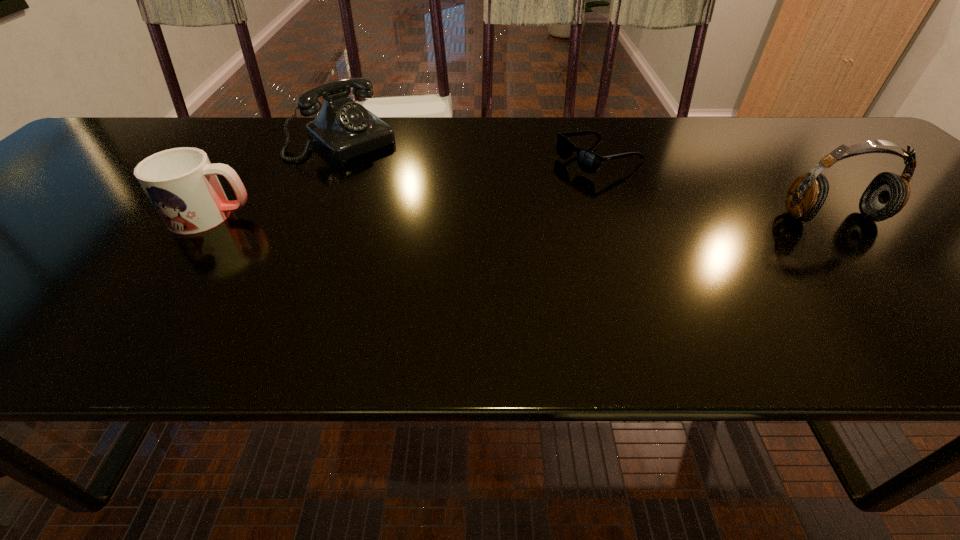
Find the location of a particular element. free spot located on the front-facing side of the second object from right to left is located at coordinates (495, 201).

Where is `free region located 0.180m on the dial of the telephone`? Image resolution: width=960 pixels, height=540 pixels. free region located 0.180m on the dial of the telephone is located at coordinates (409, 189).

You are a GUI agent. You are given a task and a screenshot of the screen. Output one action in this format:
    pyautogui.click(x=<x>, y=<y>)
    Task: Click on the free space located on the dial of the telephone
    The image size is (960, 540).
    Given the screenshot: What is the action you would take?
    pyautogui.click(x=406, y=187)

Identify the location of free space located 0.150m on the dial of the telephone. (402, 183).

Locate an element on the screen. The image size is (960, 540). sunglasses that is at the far edge is located at coordinates (588, 161).

In order to click on telephone at the far edge in this screenshot , I will do `click(343, 129)`.

In the image, there is a desktop. At what (x,y) coordinates should I click in order to perform the action: click on blank space at the far edge. Please return your answer as a coordinate pair (x, y). Looking at the image, I should click on (429, 149).

Image resolution: width=960 pixels, height=540 pixels. In order to click on vacant area at the near edge in this screenshot , I will do `click(275, 298)`.

What are the coordinates of `vacant region at the far left corner of the desktop` in the screenshot? It's located at (155, 123).

Identify the location of blank space at the far right corner of the desktop. (845, 126).